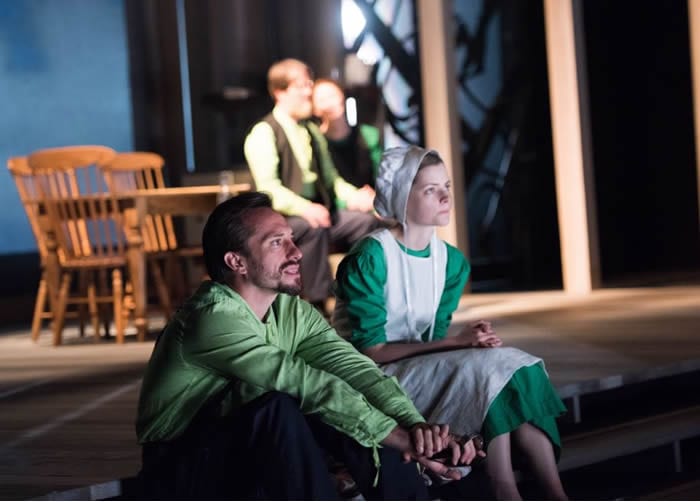
The width and height of the screenshot is (700, 502). Identify the location of stage background. (83, 69).